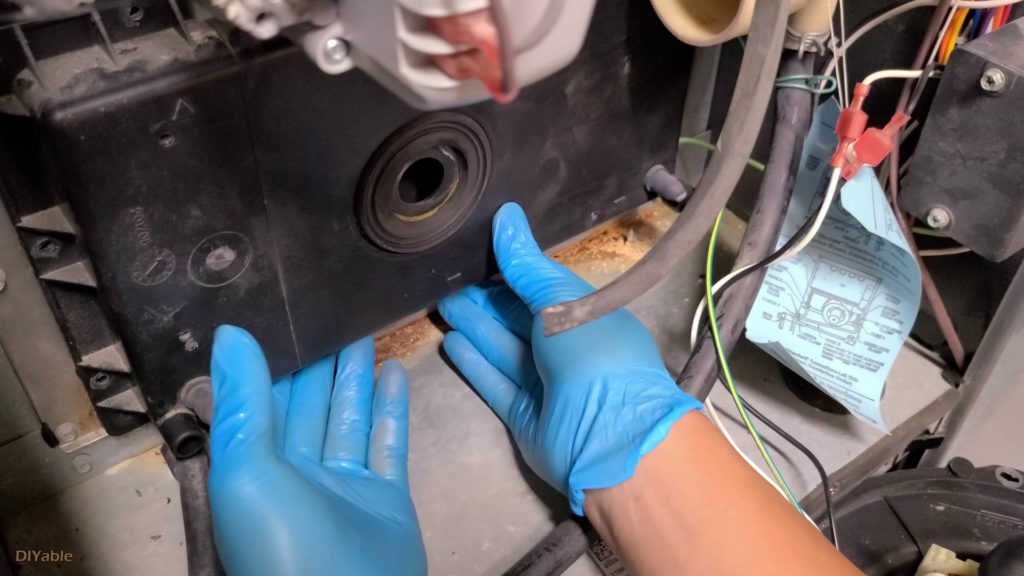
Locate an element on the screen. black cable is located at coordinates tap(790, 241).